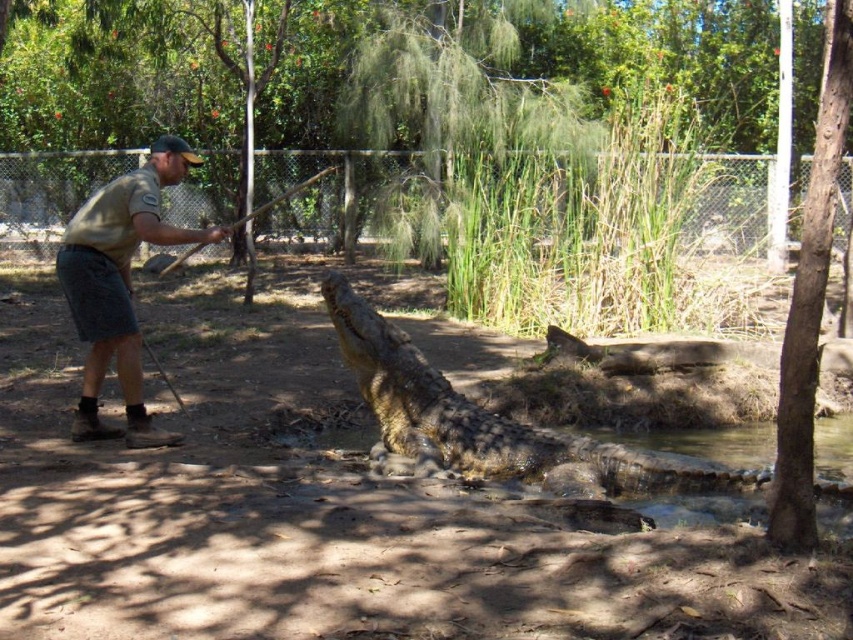
Question: Can you confirm if leathery brown crocodile at center is positioned to the left of khaki uniform at left?

Choices:
 (A) no
 (B) yes

Answer: (A)

Question: Is leathery brown crocodile at center smaller than khaki uniform at left?

Choices:
 (A) yes
 (B) no

Answer: (B)

Question: Which point is farther to the camera?

Choices:
 (A) leathery brown crocodile at center
 (B) khaki uniform at left

Answer: (B)

Question: Which point is farther from the camera taking this photo?

Choices:
 (A) (138, 429)
 (B) (540, 464)

Answer: (A)

Question: Is leathery brown crocodile at center to the right of khaki uniform at left from the viewer's perspective?

Choices:
 (A) yes
 (B) no

Answer: (A)

Question: Which of the following is the farthest from the observer?

Choices:
 (A) leathery brown crocodile at center
 (B) khaki uniform at left

Answer: (B)